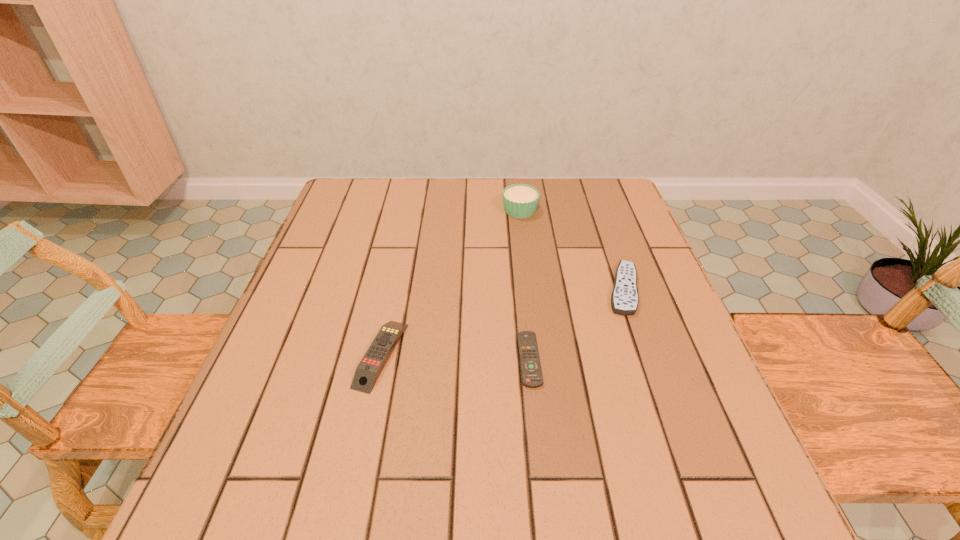
I want to click on vacant point located between the shortest remote control and the leftmost remote control, so 455,357.

Image resolution: width=960 pixels, height=540 pixels. Identify the location of vacant area that lies between the farthest object and the leftmost object. (450, 282).

The width and height of the screenshot is (960, 540). What are the coordinates of `free space between the leftmost object and the cupcake` in the screenshot? It's located at [x=450, y=282].

In order to click on blank region between the tallest object and the second remote control from left to right in this screenshot , I will do `click(524, 285)`.

The height and width of the screenshot is (540, 960). In order to click on free point between the tallest object and the shortest object in this screenshot , I will do `click(524, 285)`.

Locate an element on the screen. The width and height of the screenshot is (960, 540). vacant area between the leftmost remote control and the shortest object is located at coordinates (455, 357).

Locate an element on the screen. empty space that is in between the second shortest remote control and the tallest object is located at coordinates (571, 249).

Locate an element on the screen. vacant space in between the second shortest remote control and the farthest object is located at coordinates (571, 249).

Locate an element on the screen. Image resolution: width=960 pixels, height=540 pixels. vacant point located between the leftmost object and the shortest remote control is located at coordinates (455, 357).

Identify which object is the closest to the shortest object. Please provide its 2D coordinates. Your answer should be formatted as a tuple, i.e. [(x, y)], where the tuple contains the x and y coordinates of a point satisfying the conditions above.

[(624, 299)]